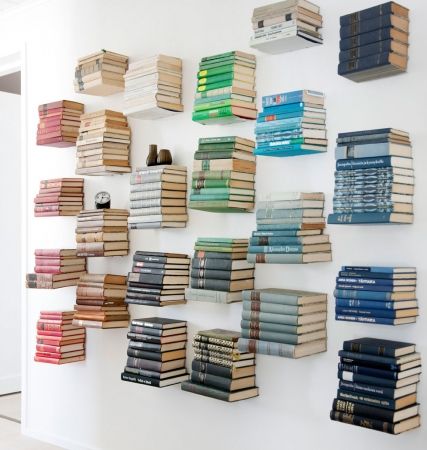
Find the location of a particular element. The image size is (427, 450). dark blue book is located at coordinates (378, 344), (379, 359), (374, 365), (374, 374), (374, 384), (374, 389), (375, 405), (375, 409), (376, 420).